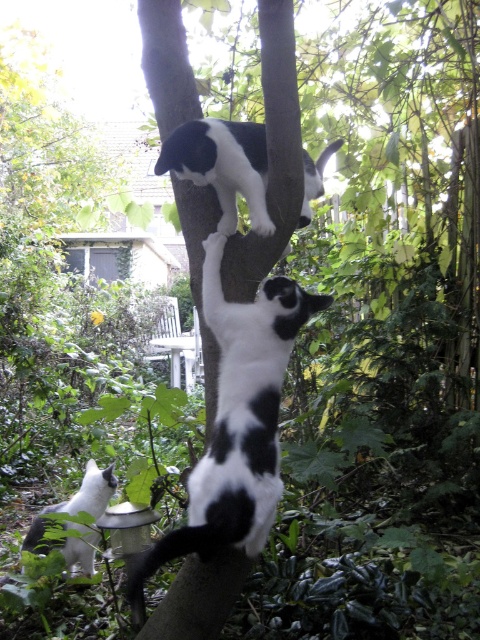
Looking at this image, you are a photographer trying to capture a clear photo of the black and white fur cat at center and the black and white fur cat at upper center. However, you notice that one of the cats might be blocking the other in your shot. Which cat is positioned in front and thus might block the other?

The black and white fur cat at center is in front of the black and white fur cat at upper center, so it might block the view of the upper cat in the photo.

You are a photographer trying to capture a photo of both cats. You are currently standing in front of the white soft fur cat at lower left. Which direction should you move to get a better shot of the black and white fur cat at upper center?

The black and white fur cat at upper center is to the right of the white soft fur cat at lower left. So you should move to the right to capture the black and white fur cat at upper center in your photo.

You are a photographer trying to capture a photo of both cats. You want to ensure that the black and white fur cat at center and the black and white fur cat at upper center are both in focus. Given that your camera can only focus on objects within a 10 cm height difference, will both cats be in focus?

The black and white fur cat at center is taller than the black and white fur cat at upper center. Since the height difference between them is not specified, but the camera can focus within a 10 cm height difference, it is possible that both cats will be in focus if their height difference is within that range. However, without exact measurements, we cannot be certain.